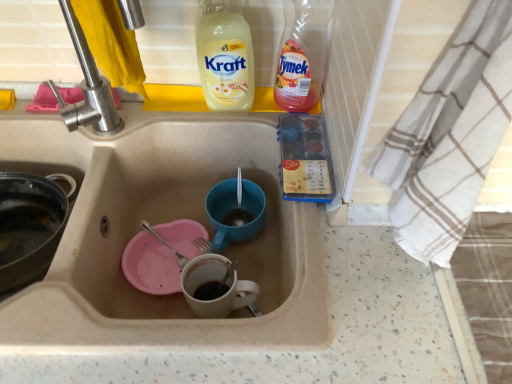
Where is `vacant region in front of white cotton towel at right`? Image resolution: width=512 pixels, height=384 pixels. vacant region in front of white cotton towel at right is located at coordinates (418, 316).